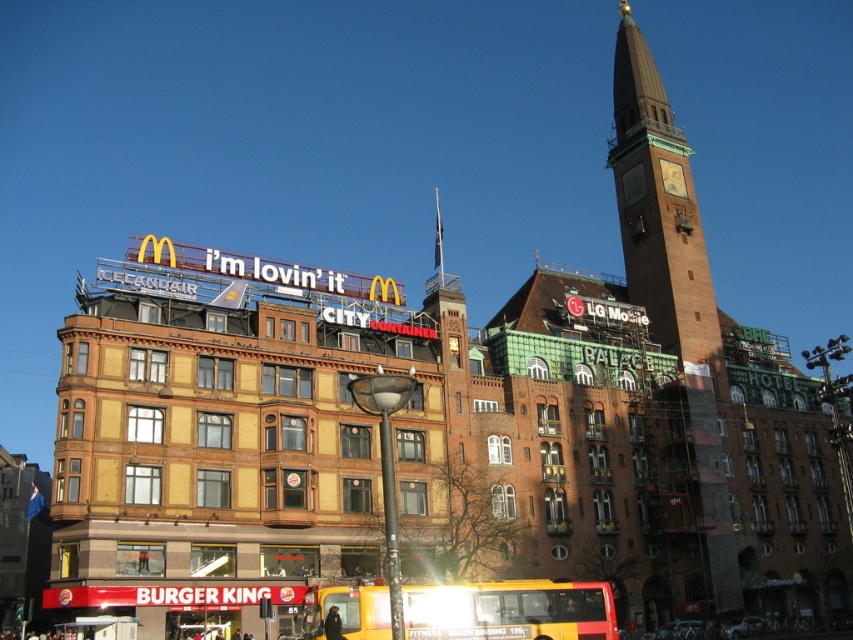
Question: Is brown brick clock tower at center bigger than yellow matte bus at lower center?

Choices:
 (A) yes
 (B) no

Answer: (A)

Question: Which of the following is the closest to the observer?

Choices:
 (A) click(x=729, y=564)
 (B) click(x=514, y=612)

Answer: (B)

Question: Is brown brick clock tower at center closer to the viewer compared to yellow matte bus at lower center?

Choices:
 (A) no
 (B) yes

Answer: (A)

Question: Which object is farther from the camera taking this photo?

Choices:
 (A) yellow matte bus at lower center
 (B) brown brick clock tower at center

Answer: (B)

Question: Can you confirm if brown brick clock tower at center is positioned to the left of yellow matte bus at lower center?

Choices:
 (A) no
 (B) yes

Answer: (A)

Question: Which object appears closest to the camera in this image?

Choices:
 (A) yellow matte bus at lower center
 (B) brown brick clock tower at center

Answer: (A)